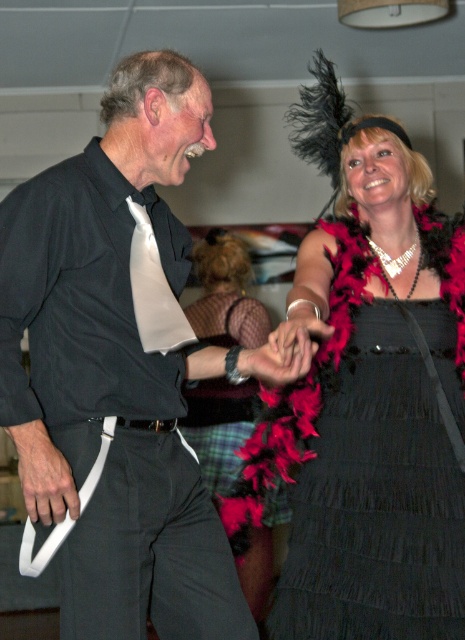
Question: Among these objects, which one is farthest from the camera?

Choices:
 (A) white silk tie at left
 (B) black leather belt at center

Answer: (A)

Question: Which point appears farthest from the camera in this image?

Choices:
 (A) (67, 637)
 (B) (125, 426)
 (C) (144, 244)

Answer: (C)

Question: Observing the image, what is the correct spatial positioning of black satin dress at center in reference to black leather belt at center?

Choices:
 (A) below
 (B) above

Answer: (B)

Question: Based on their relative distances, which object is nearer to the matte black shirt at center?

Choices:
 (A) white silk tie at left
 (B) black satin dress at center
 (C) black leather belt at center

Answer: (A)

Question: From the image, what is the correct spatial relationship of black satin dress at center in relation to black leather belt at center?

Choices:
 (A) left
 (B) right

Answer: (B)

Question: Can you confirm if matte black shirt at center is positioned below black leather belt at center?

Choices:
 (A) yes
 (B) no

Answer: (B)